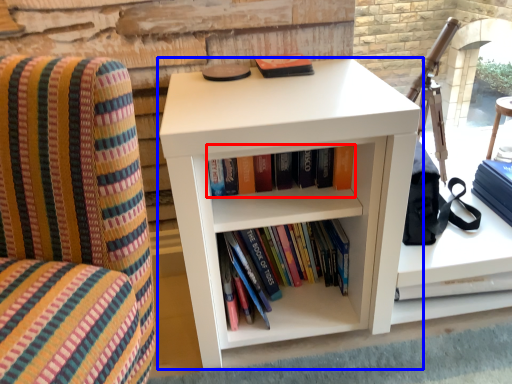
Question: Which object appears farthest to the camera in this image, book (highlighted by a red box) or shelf (highlighted by a blue box)?

Choices:
 (A) book
 (B) shelf

Answer: (A)